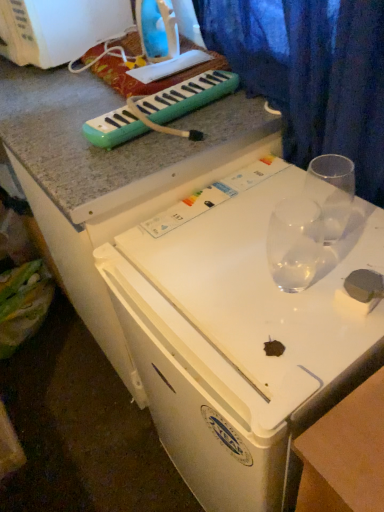
Identify the location of free space behind clear glass martini glass at center, the 2th martini glass positioned from the right. The width and height of the screenshot is (384, 512). (273, 220).